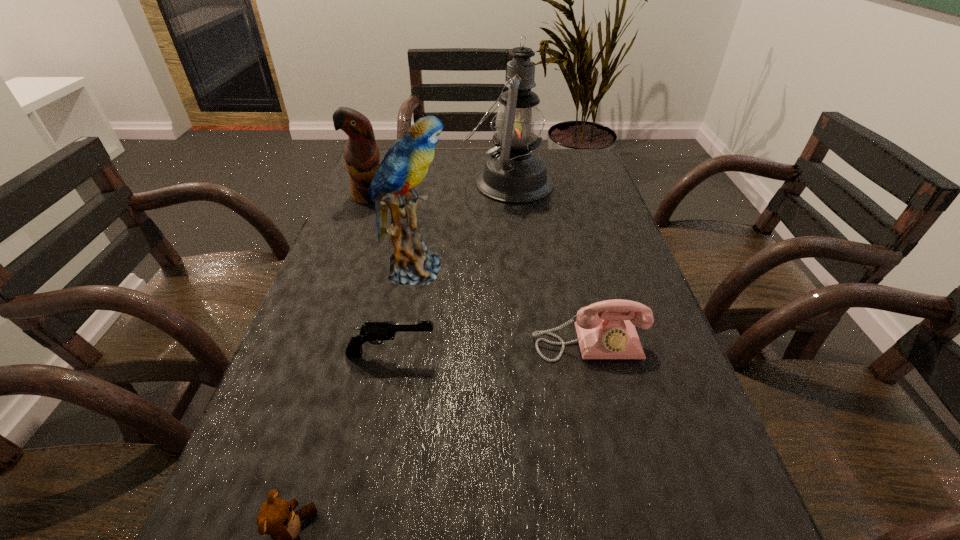
In order to click on vacant space located on the dial of the fourth tallest object in this screenshot , I will do `click(605, 411)`.

This screenshot has height=540, width=960. I want to click on vacant space positioned 0.180m at the end of the barrel of the gun, so click(532, 353).

At what (x,y) coordinates should I click in order to perform the action: click on object that is positioned at the far edge. Please return your answer as a coordinate pair (x, y). Looking at the image, I should click on (513, 174).

I want to click on gun situated at the left edge, so click(x=375, y=332).

The width and height of the screenshot is (960, 540). In order to click on oil lamp at the right edge in this screenshot , I will do `click(513, 174)`.

Find the location of a particular element. This screenshot has height=540, width=960. telephone located at the right edge is located at coordinates [611, 334].

Where is `object situated at the far right corner`? This screenshot has height=540, width=960. object situated at the far right corner is located at coordinates (513, 174).

In the image, there is a desktop. What are the coordinates of `vacant space at the far edge` in the screenshot? It's located at (444, 158).

The height and width of the screenshot is (540, 960). In order to click on vacant space at the left edge in this screenshot , I will do `click(235, 475)`.

The height and width of the screenshot is (540, 960). Find the location of `free location at the right edge of the desktop`. free location at the right edge of the desktop is located at coordinates (633, 520).